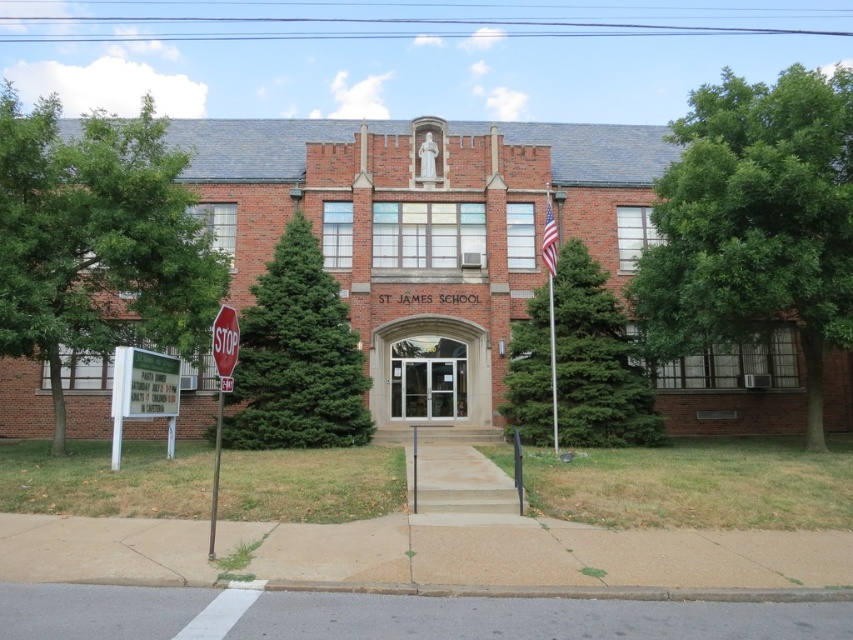
Question: Does green leafy tree at left appear on the left side of metallic pole at lower left?

Choices:
 (A) yes
 (B) no

Answer: (A)

Question: Can you confirm if green coniferous tree at center is positioned above red matte stop sign at left?

Choices:
 (A) yes
 (B) no

Answer: (B)

Question: Is green leafy tree at right closer to camera compared to metallic pole at lower left?

Choices:
 (A) yes
 (B) no

Answer: (B)

Question: Among these objects, which one is nearest to the camera?

Choices:
 (A) green coniferous tree at center
 (B) metallic flagpole at right

Answer: (A)

Question: Which point is closer to the camera?

Choices:
 (A) green fir tree at left
 (B) green leafy tree at left
 (C) metallic pole at lower left

Answer: (C)

Question: Which object is farther from the camera taking this photo?

Choices:
 (A) green fir tree at left
 (B) metallic pole at lower left

Answer: (A)